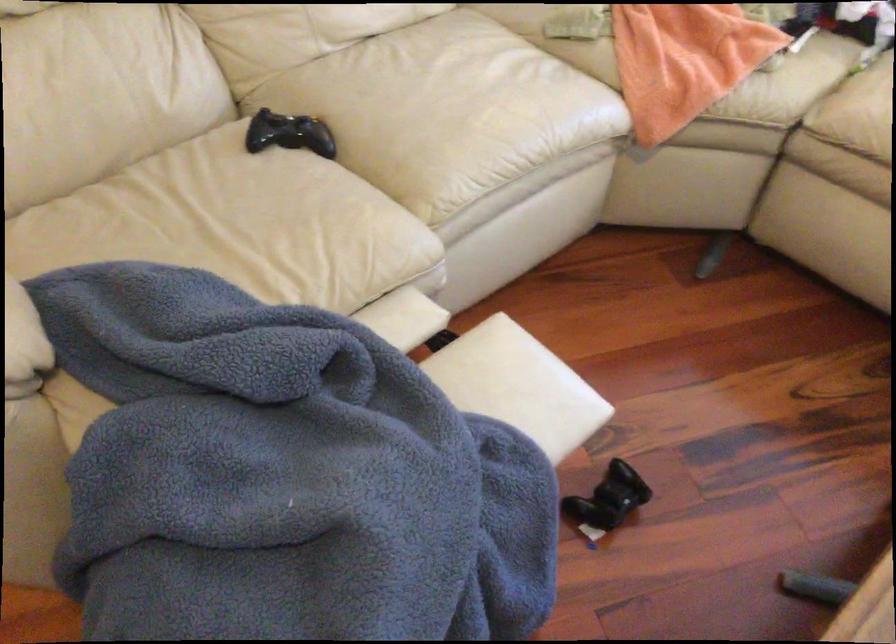
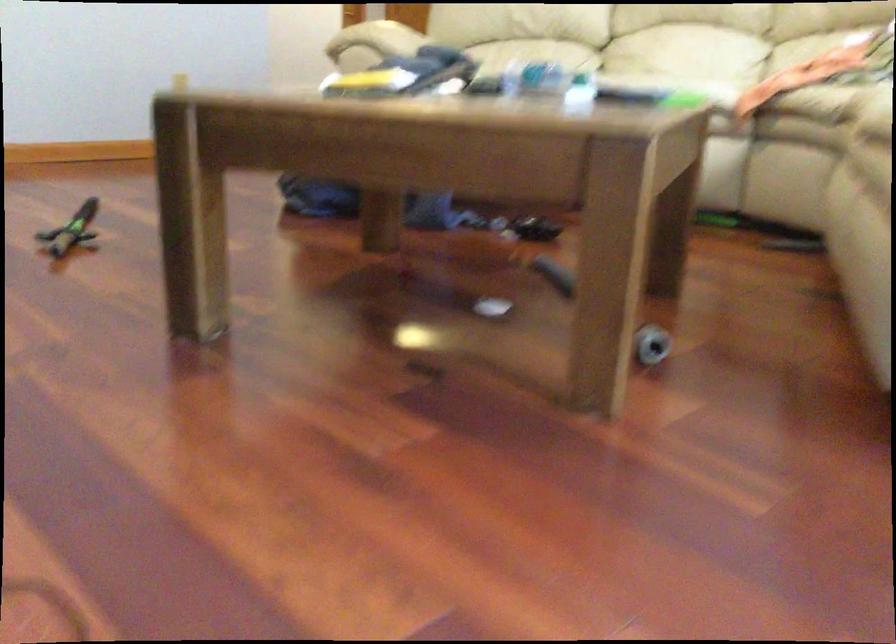
Question: I am providing you with two images of the same scene from different viewpoints. After the viewpoint changes to image2, which objects are now occluded?

Choices:
 (A) clear plastic bottle
 (B) green toy sword
 (C) white sofa cushion
 (D) striped pouch

Answer: (C)